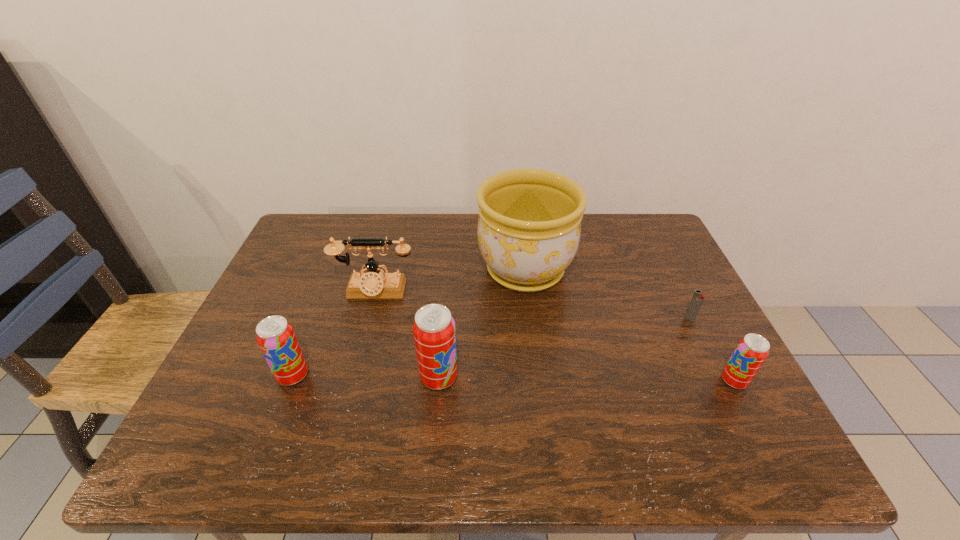
The image size is (960, 540). I want to click on object that is positioned at the near left corner, so click(x=276, y=338).

You are a GUI agent. You are given a task and a screenshot of the screen. Output one action in this format:
    pyautogui.click(x=<x>, y=<y>)
    Task: Click on the object that is at the near right corner
    The image size is (960, 540).
    Given the screenshot: What is the action you would take?
    pyautogui.click(x=750, y=353)

In the image, there is a desktop. Where is `vacant region at the far edge`? Image resolution: width=960 pixels, height=540 pixels. vacant region at the far edge is located at coordinates tap(398, 239).

In the image, there is a desktop. At what (x,y) coordinates should I click in order to perform the action: click on free space at the near edge. Please return your answer as a coordinate pair (x, y). The image size is (960, 540). Looking at the image, I should click on (402, 420).

Locate an element on the screen. free space at the left edge of the desktop is located at coordinates (304, 280).

In the image, there is a desktop. In order to click on free region at the right edge in this screenshot , I will do `click(673, 268)`.

Where is `vacant space at the far left corner`? The image size is (960, 540). vacant space at the far left corner is located at coordinates point(341,227).

Find the location of a particular element. This screenshot has width=960, height=540. vacant area at the far right corner is located at coordinates (617, 226).

The width and height of the screenshot is (960, 540). Identify the location of blank region between the igniter and the second shortest object. (712, 350).

You are a GUI agent. You are given a task and a screenshot of the screen. Output one action in this format:
    pyautogui.click(x=<x>, y=<y>)
    Task: Click on the vacant space that's between the tallest object and the second shortest object
    
    Given the screenshot: What is the action you would take?
    pyautogui.click(x=630, y=326)